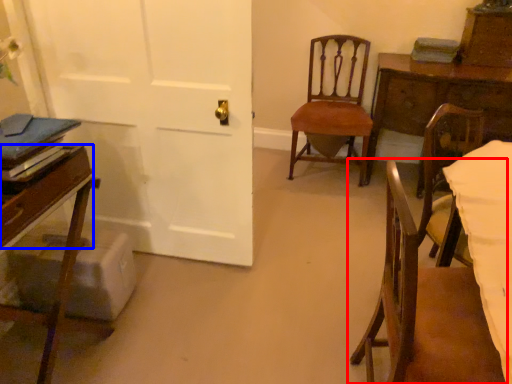
Question: Which of the following is the closest to the observer, chair (highlighted by a red box) or drawer (highlighted by a blue box)?

Choices:
 (A) chair
 (B) drawer

Answer: (A)